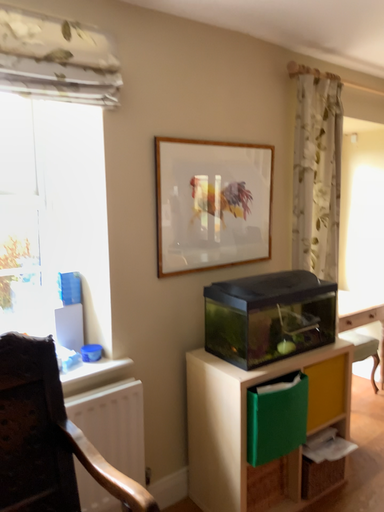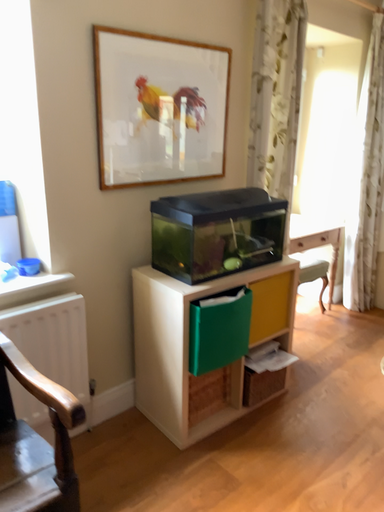
Question: How did the camera likely rotate when shooting the video?

Choices:
 (A) rotated upward
 (B) rotated downward

Answer: (B)